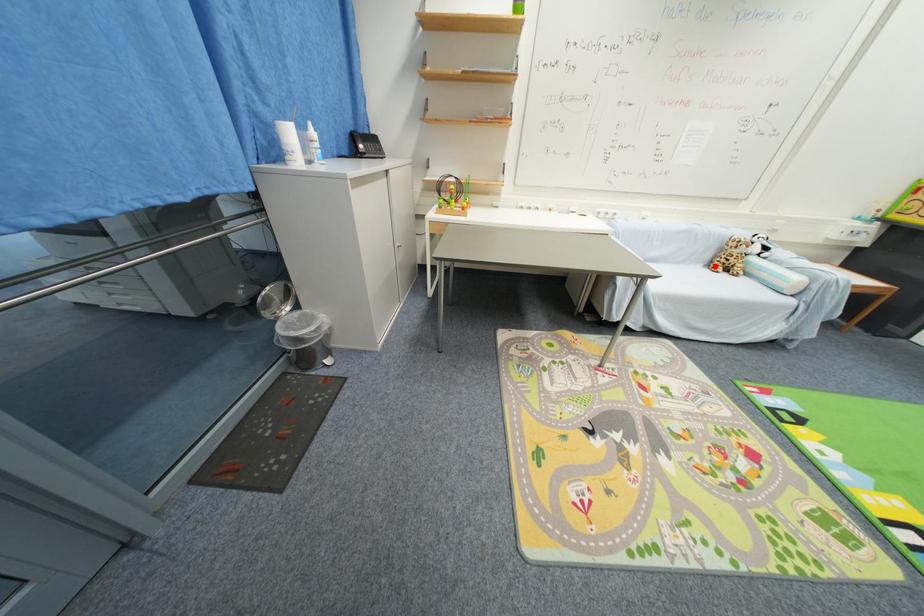
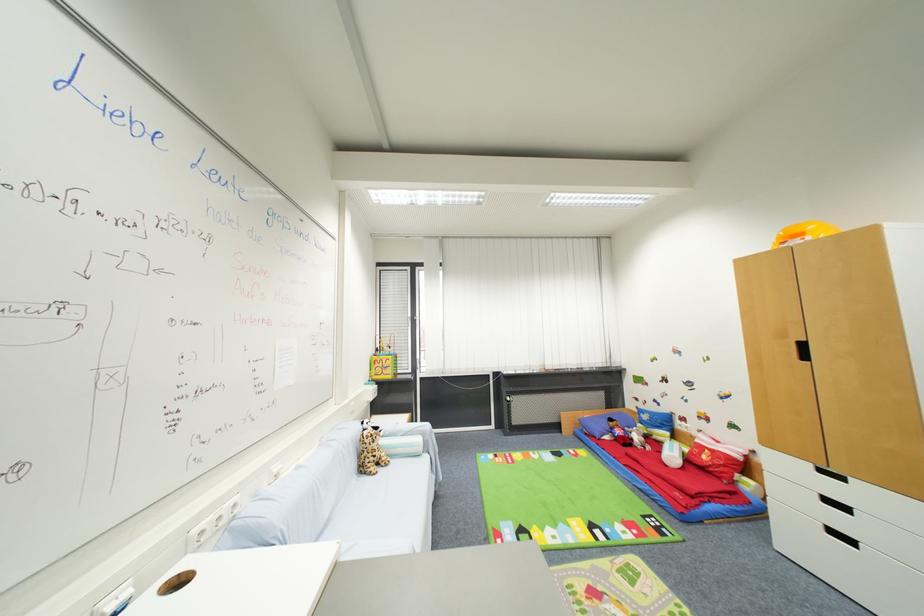
Question: I am providing you with two images of the same scene from different viewpoints. A red point is shown in image1. For the corresponding object point in image2, is it positioned nearer or farther from the camera?

Choices:
 (A) Nearer
 (B) Farther

Answer: (B)